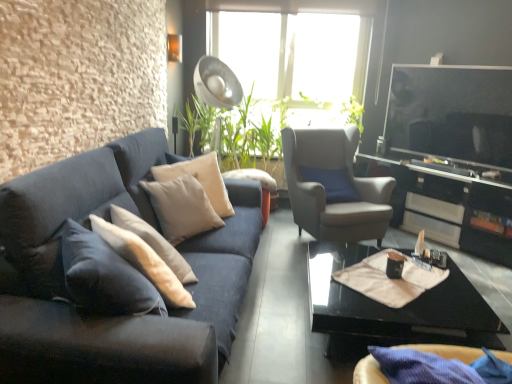
Identify the location of vacant space underneath beige fabric at center (from a real-world perspective). The width and height of the screenshot is (512, 384). (376, 282).